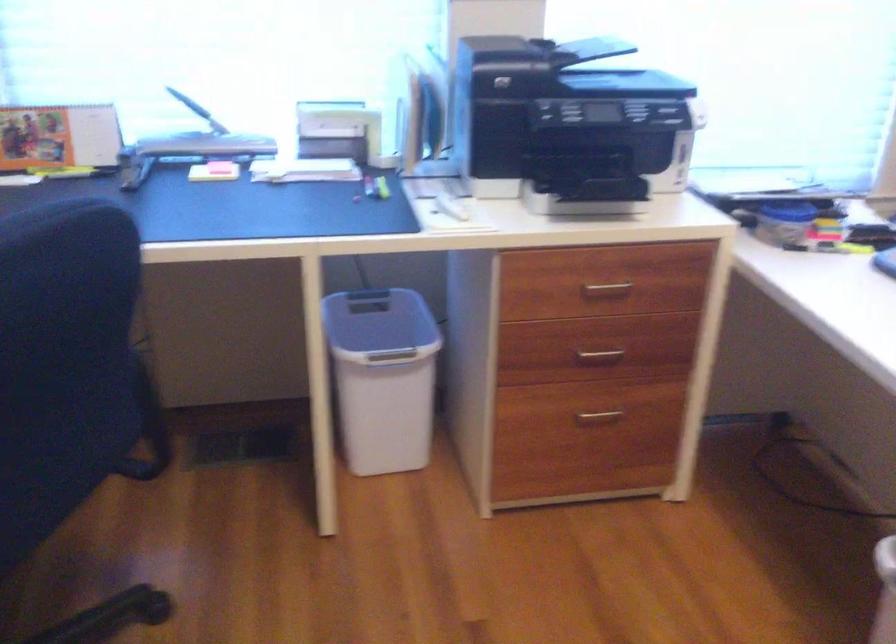
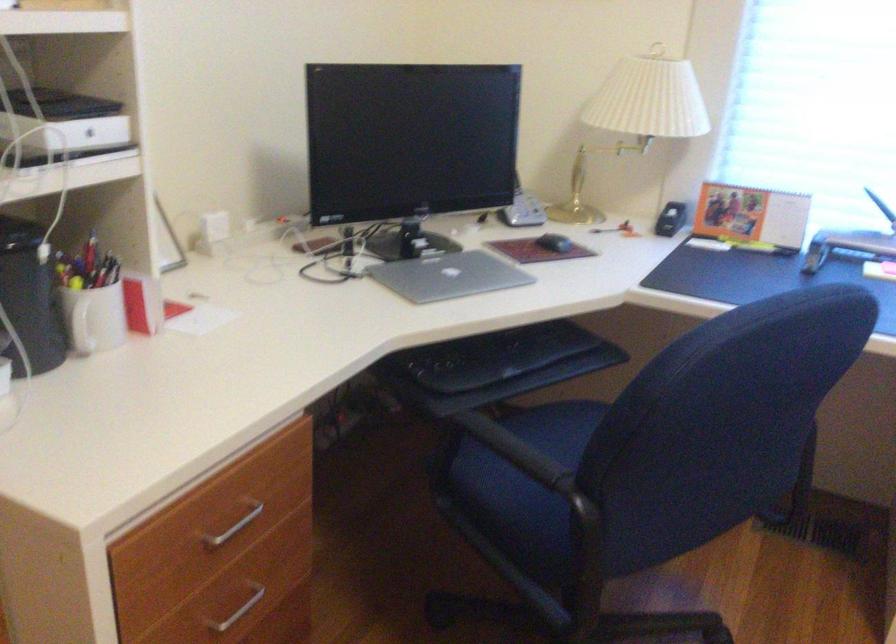
Question: I am providing you with two images of the same scene from different viewpoints. Please identify which objects are invisible in image2.

Choices:
 (A) silver laptop computer
 (B) black chair armrest
 (C) metal drawer handle
 (D) none of these

Answer: (D)